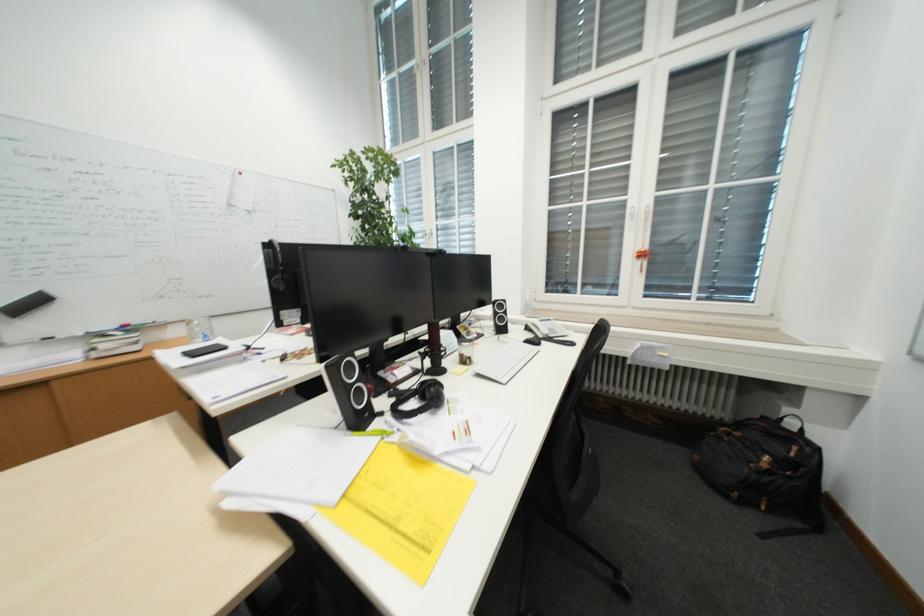
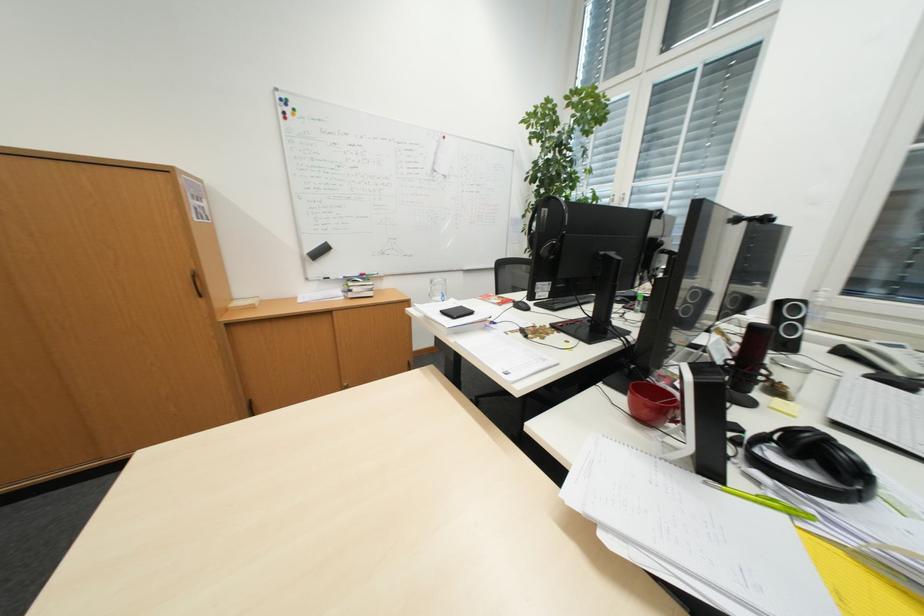
Question: The camera is either moving clockwise (left) or counter-clockwise (right) around the object. The first image is from the beginning of the video and the second image is from the end. Is the camera moving left or right when shooting the video?

Choices:
 (A) Left
 (B) Right

Answer: (B)